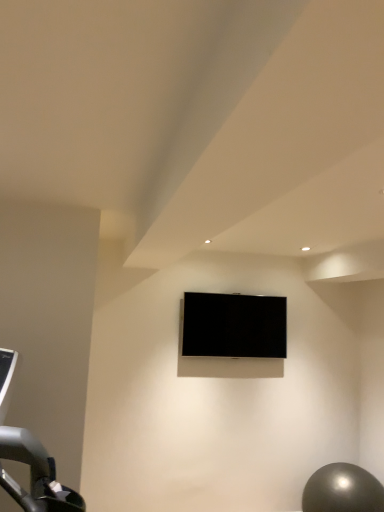
What do you see at coordinates (342, 490) in the screenshot? The image size is (384, 512). I see `metallic gray ball at lower right` at bounding box center [342, 490].

Image resolution: width=384 pixels, height=512 pixels. I want to click on metallic gray ball at lower right, so click(342, 490).

This screenshot has height=512, width=384. What do you see at coordinates (234, 326) in the screenshot?
I see `black glossy tv at center` at bounding box center [234, 326].

Where is `black glossy tv at center`? black glossy tv at center is located at coordinates (234, 326).

Locate an element on the screen. This screenshot has width=384, height=512. metallic gray ball at lower right is located at coordinates (342, 490).

Considering the relative positions of metallic gray ball at lower right and black glossy tv at center in the image provided, is metallic gray ball at lower right to the right of black glossy tv at center from the viewer's perspective?

Indeed, metallic gray ball at lower right is positioned on the right side of black glossy tv at center.

Does metallic gray ball at lower right come in front of black glossy tv at center?

Yes, it is.

Which is farther from the camera, (317, 475) or (260, 355)?

The point (260, 355) is more distant.

From the image's perspective, is metallic gray ball at lower right located above or below black glossy tv at center?

From the image's perspective, metallic gray ball at lower right appears below black glossy tv at center.

From a real-world perspective, who is located lower, metallic gray ball at lower right or black glossy tv at center?

In real-world perspective, metallic gray ball at lower right is lower.

Considering the sizes of objects metallic gray ball at lower right and black glossy tv at center in the image provided, who is thinner, metallic gray ball at lower right or black glossy tv at center?

black glossy tv at center.

In terms of height, does metallic gray ball at lower right look taller or shorter compared to black glossy tv at center?

Considering their sizes, metallic gray ball at lower right has less height than black glossy tv at center.

Looking at the image, does metallic gray ball at lower right seem bigger or smaller compared to black glossy tv at center?

Considering their sizes, metallic gray ball at lower right takes up more space than black glossy tv at center.

Is metallic gray ball at lower right positioned beyond the bounds of black glossy tv at center?

Indeed, metallic gray ball at lower right is completely outside black glossy tv at center.

Is metallic gray ball at lower right in contact with black glossy tv at center?

No, metallic gray ball at lower right is not making contact with black glossy tv at center.

Based on the photo, is metallic gray ball at lower right facing away from black glossy tv at center?

No, metallic gray ball at lower right is not facing the opposite direction of black glossy tv at center.

What's the angular difference between metallic gray ball at lower right and black glossy tv at center's facing directions?

The angle between the facing direction of metallic gray ball at lower right and the facing direction of black glossy tv at center is 1.16 degrees.

How far apart are metallic gray ball at lower right and black glossy tv at center?

3.93 feet.

At what (x,y) coordinates should I click in order to perform the action: click on television lying behind the metallic gray ball at lower right. Please return your answer as a coordinate pair (x, y). This screenshot has width=384, height=512. Looking at the image, I should click on (234, 326).

Does black glossy tv at center appear on the left side of metallic gray ball at lower right?

Yes, black glossy tv at center is to the left of metallic gray ball at lower right.

Is the depth of black glossy tv at center less than that of metallic gray ball at lower right?

No, black glossy tv at center is further to the viewer.

Considering the positions of point (188, 335) and point (319, 486), is point (188, 335) closer or farther from the camera than point (319, 486)?

Point (188, 335) is positioned farther from the camera compared to point (319, 486).

From the image's perspective, is black glossy tv at center located above metallic gray ball at lower right?

Correct, black glossy tv at center appears higher than metallic gray ball at lower right in the image.

From a real-world perspective, is black glossy tv at center positioned over metallic gray ball at lower right based on gravity?

Yes.

Considering the relative sizes of black glossy tv at center and metallic gray ball at lower right in the image provided, is black glossy tv at center wider than metallic gray ball at lower right?

No, black glossy tv at center is not wider than metallic gray ball at lower right.

Considering the sizes of objects black glossy tv at center and metallic gray ball at lower right in the image provided, who is taller, black glossy tv at center or metallic gray ball at lower right?

Standing taller between the two is black glossy tv at center.

Is black glossy tv at center bigger than metallic gray ball at lower right?

No.

Is black glossy tv at center inside or outside of metallic gray ball at lower right?

black glossy tv at center exists outside the volume of metallic gray ball at lower right.

Does black glossy tv at center touch metallic gray ball at lower right?

They are not placed beside each other.

In the scene shown: Does black glossy tv at center turn towards metallic gray ball at lower right?

No, black glossy tv at center is not facing towards metallic gray ball at lower right.

Can you tell me how much black glossy tv at center and metallic gray ball at lower right differ in facing direction?

The facing directions of black glossy tv at center and metallic gray ball at lower right are 1.16 degrees apart.

How much distance is there between black glossy tv at center and metallic gray ball at lower right?

black glossy tv at center and metallic gray ball at lower right are 1.20 meters apart.

At what (x,y) coordinates should I click in order to perform the action: click on television above the metallic gray ball at lower right (from the image's perspective). Please return your answer as a coordinate pair (x, y). This screenshot has height=512, width=384. Looking at the image, I should click on (234, 326).

There is a metallic gray ball at lower right. At what (x,y) coordinates should I click in order to perform the action: click on television above it (from a real-world perspective). Please return your answer as a coordinate pair (x, y). This screenshot has height=512, width=384. Looking at the image, I should click on (234, 326).

The height and width of the screenshot is (512, 384). What are the coordinates of `ball on the right of black glossy tv at center` in the screenshot? It's located at (342, 490).